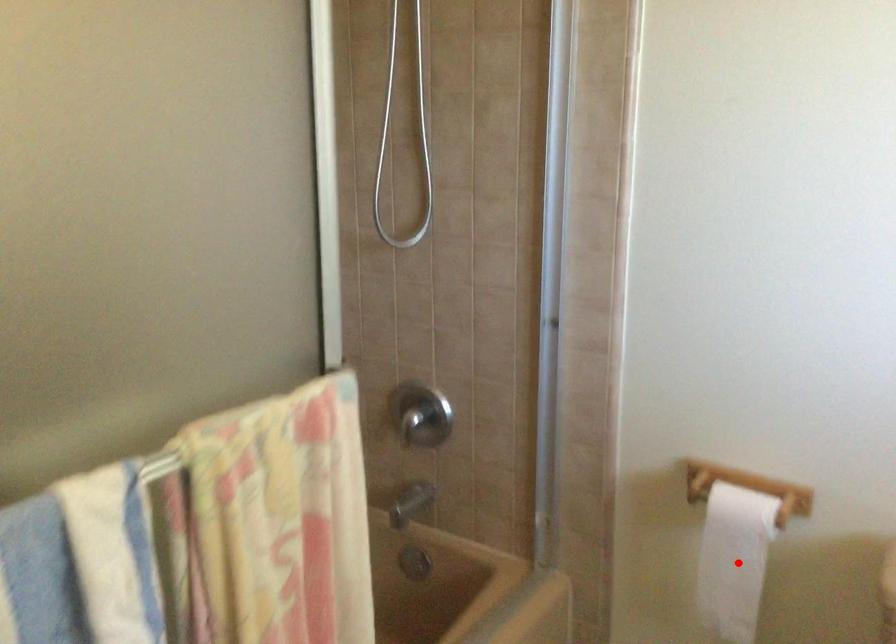
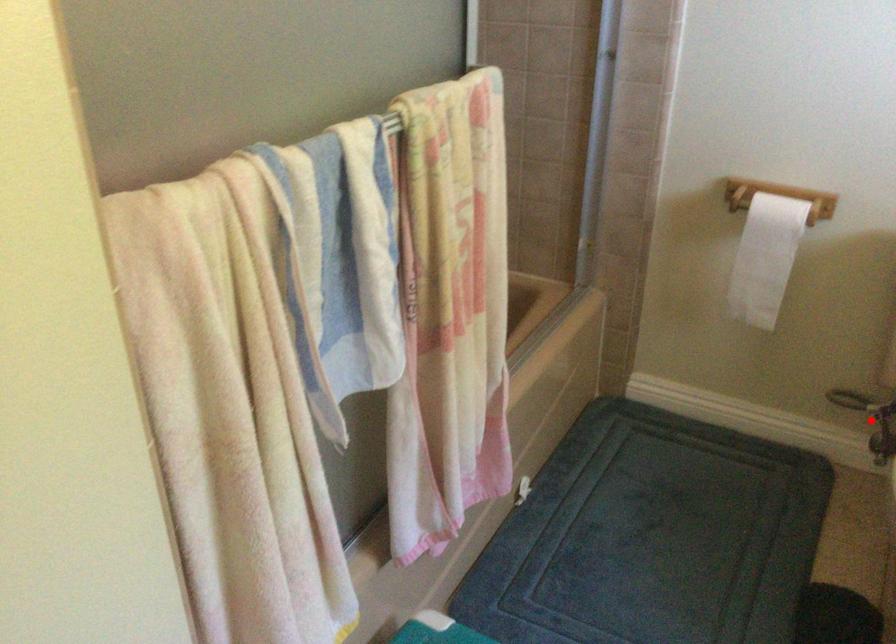
I am providing you with two images of the same scene from different viewpoints. A red point is marked on the first image and another point is marked on the second image. Are the points marked in image1 and image2 representing the same 3D position?

No